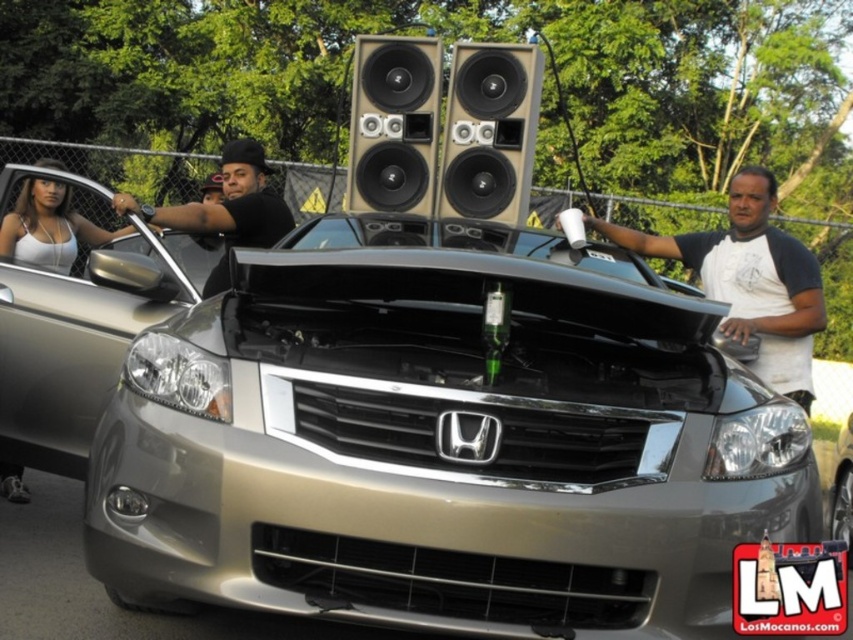
You are standing at the origin point of the coordinate system. The silver Honda vehicle is in front of you. Where is the black matte shirt at center located in relation to the car?

The black matte shirt at center is located at coordinate point 0.328 on the x axis and 0.266 on the y axis relative to the car.

You are planning to install a new speaker system on your car. The matte black speaker at center and the metallic silver car at center are part of your current setup. If your new speaker is 2.5 meters long, will it fit between them without overlapping?

The distance between the matte black speaker at center and the metallic silver car at center is 3.06 meters. Since the new speaker is 2.5 meters long, it will fit between them without overlapping as there is enough space.